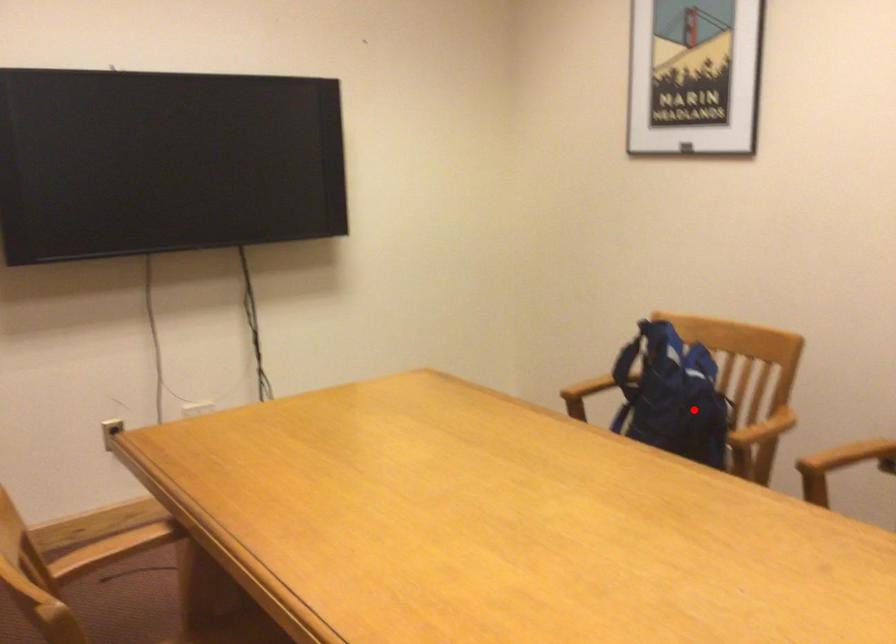
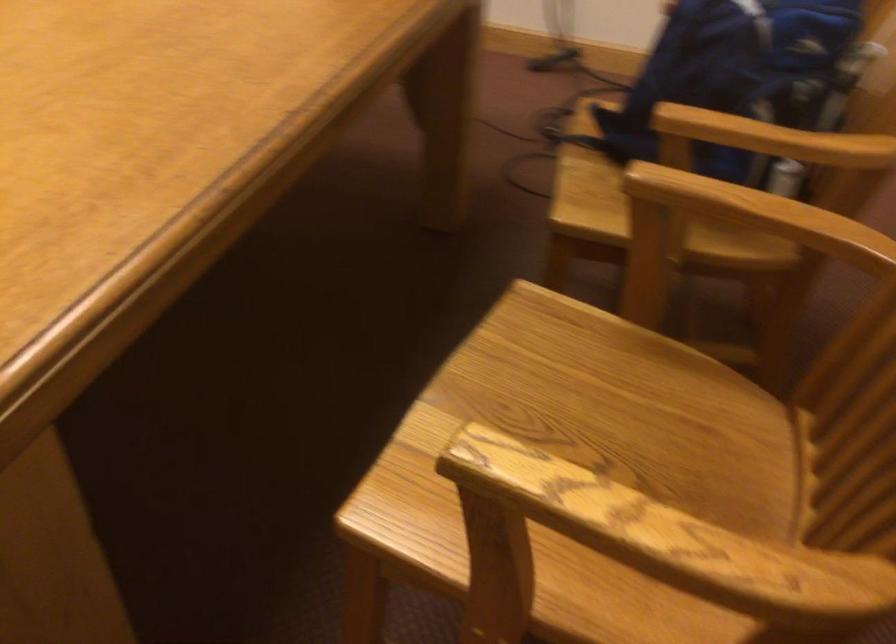
Question: I am providing you with two images of the same scene from different viewpoints. A red point is shown in image1. For the corresponding object point in image2, is it positioned nearer or farther from the camera?

Choices:
 (A) Nearer
 (B) Farther

Answer: (A)